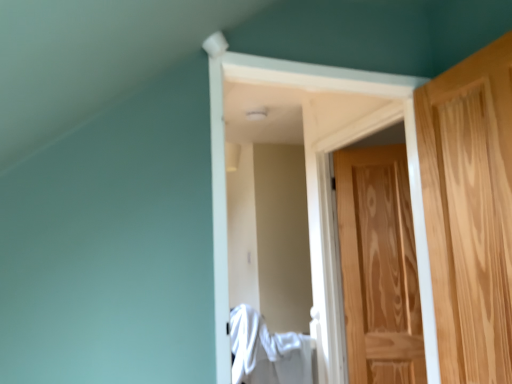
Describe the element at coordinates (379, 266) in the screenshot. I see `natural wood door at right, which appears as the 1th door when viewed from the back` at that location.

You are a GUI agent. You are given a task and a screenshot of the screen. Output one action in this format:
    pyautogui.click(x=<x>, y=<y>)
    Task: Click on the natural wood door at right, which appears as the 1th door when viewed from the back
    Image resolution: width=512 pixels, height=384 pixels.
    Given the screenshot: What is the action you would take?
    pyautogui.click(x=379, y=266)

Is white fabric at center not within natural wood door at right, which appears as the 1th door when viewed from the back?

Indeed, white fabric at center is completely outside natural wood door at right, which appears as the 1th door when viewed from the back.

Is white fabric at center at the left side of natural wood door at right, which is the second door from front to back?

Yes.

Can you tell me how much white fabric at center and natural wood door at right, which is the second door from front to back, differ in facing direction?

27.1 degrees.

Where is `door that is the 2nd object above the white fabric at center (from a real-world perspective)`? The width and height of the screenshot is (512, 384). door that is the 2nd object above the white fabric at center (from a real-world perspective) is located at coordinates (470, 212).

From the image's perspective, between light brown wood door at right, positioned as the 1th door in front-to-back order, and white fabric at center, who is located below?

From the image's view, white fabric at center is below.

How distant is light brown wood door at right, positioned as the 1th door in front-to-back order, from white fabric at center?

A distance of 4.12 feet exists between light brown wood door at right, positioned as the 1th door in front-to-back order, and white fabric at center.

From a real-world perspective, which is physically below, natural wood door at right, which is the second door from front to back, or light brown wood door at right, positioned as the 1th door in front-to-back order?

From a 3D spatial view, natural wood door at right, which is the second door from front to back, is below.

Is natural wood door at right, which is the second door from front to back, thinner than light brown wood door at right, positioned as the 1th door in front-to-back order?

Yes, natural wood door at right, which is the second door from front to back, is thinner than light brown wood door at right, positioned as the 1th door in front-to-back order.

Is natural wood door at right, which appears as the 1th door when viewed from the back, positioned beyond the bounds of light brown wood door at right, the second door positioned from the back?

Yes, natural wood door at right, which appears as the 1th door when viewed from the back, is not within light brown wood door at right, the second door positioned from the back.

Which is in front, point (301, 342) or point (507, 111)?

The point (507, 111) is more forward.

From a real-world perspective, who is located lower, white fabric at center or light brown wood door at right, the second door positioned from the back?

white fabric at center.

Would you say white fabric at center is a long distance from light brown wood door at right, the second door positioned from the back?

That's right, there is a large distance between white fabric at center and light brown wood door at right, the second door positioned from the back.

Who is taller, white fabric at center or light brown wood door at right, the second door positioned from the back?

light brown wood door at right, the second door positioned from the back.

Is light brown wood door at right, positioned as the 1th door in front-to-back order, looking in the opposite direction of natural wood door at right, which is the second door from front to back?

No, light brown wood door at right, positioned as the 1th door in front-to-back order,'s orientation is not away from natural wood door at right, which is the second door from front to back.

From a real-world perspective, which is physically below, light brown wood door at right, positioned as the 1th door in front-to-back order, or natural wood door at right, which is the second door from front to back?

natural wood door at right, which is the second door from front to back.

Based on the photo, from the image's perspective, which is above, light brown wood door at right, the second door positioned from the back, or natural wood door at right, which is the second door from front to back?

light brown wood door at right, the second door positioned from the back, from the image's perspective.

Which point is more distant from viewer, (454, 354) or (401, 305)?

Point (401, 305)

Does point (385, 283) appear closer or farther from the camera than point (253, 332)?

Point (385, 283) appears to be closer to the viewer than point (253, 332).

In the image, is natural wood door at right, which appears as the 1th door when viewed from the back, on the left side or the right side of white fabric at center?

natural wood door at right, which appears as the 1th door when viewed from the back, is positioned on white fabric at center's right side.

The image size is (512, 384). There is a white fabric at center. What are the coordinates of `the 1st door above it (from a real-world perspective)` in the screenshot? It's located at (379, 266).

Is natural wood door at right, which is the second door from front to back, spatially inside white fabric at center, or outside of it?

natural wood door at right, which is the second door from front to back, lies outside white fabric at center.

This screenshot has width=512, height=384. I want to click on laundry below the natural wood door at right, which is the second door from front to back (from a real-world perspective), so click(x=268, y=352).

This screenshot has width=512, height=384. Find the location of `the 1st door to the right of the white fabric at center, starting your count from the anchor`. the 1st door to the right of the white fabric at center, starting your count from the anchor is located at coordinates (470, 212).

Estimate the real-world distances between objects in this image. Which object is further from white fabric at center, light brown wood door at right, positioned as the 1th door in front-to-back order, or natural wood door at right, which appears as the 1th door when viewed from the back?

light brown wood door at right, positioned as the 1th door in front-to-back order, lies further to white fabric at center than the other object.

When comparing their distances from white fabric at center, does natural wood door at right, which is the second door from front to back, or light brown wood door at right, positioned as the 1th door in front-to-back order, seem further?

light brown wood door at right, positioned as the 1th door in front-to-back order, is further to white fabric at center.

From the image, which object appears to be nearer to natural wood door at right, which appears as the 1th door when viewed from the back, white fabric at center or light brown wood door at right, positioned as the 1th door in front-to-back order?

white fabric at center lies closer to natural wood door at right, which appears as the 1th door when viewed from the back, than the other object.

Based on the photo, based on their spatial positions, is light brown wood door at right, positioned as the 1th door in front-to-back order, or white fabric at center closer to natural wood door at right, which appears as the 1th door when viewed from the back?

Based on the image, white fabric at center appears to be nearer to natural wood door at right, which appears as the 1th door when viewed from the back.

Estimate the real-world distances between objects in this image. Which object is closer to light brown wood door at right, positioned as the 1th door in front-to-back order, white fabric at center or natural wood door at right, which appears as the 1th door when viewed from the back?

Based on the image, natural wood door at right, which appears as the 1th door when viewed from the back, appears to be nearer to light brown wood door at right, positioned as the 1th door in front-to-back order.

Considering their positions, is natural wood door at right, which appears as the 1th door when viewed from the back, positioned closer to light brown wood door at right, the second door positioned from the back, than white fabric at center?

natural wood door at right, which appears as the 1th door when viewed from the back.

In order to click on laundry positioned between light brown wood door at right, positioned as the 1th door in front-to-back order, and natural wood door at right, which is the second door from front to back, from near to far in this screenshot , I will do `click(268, 352)`.